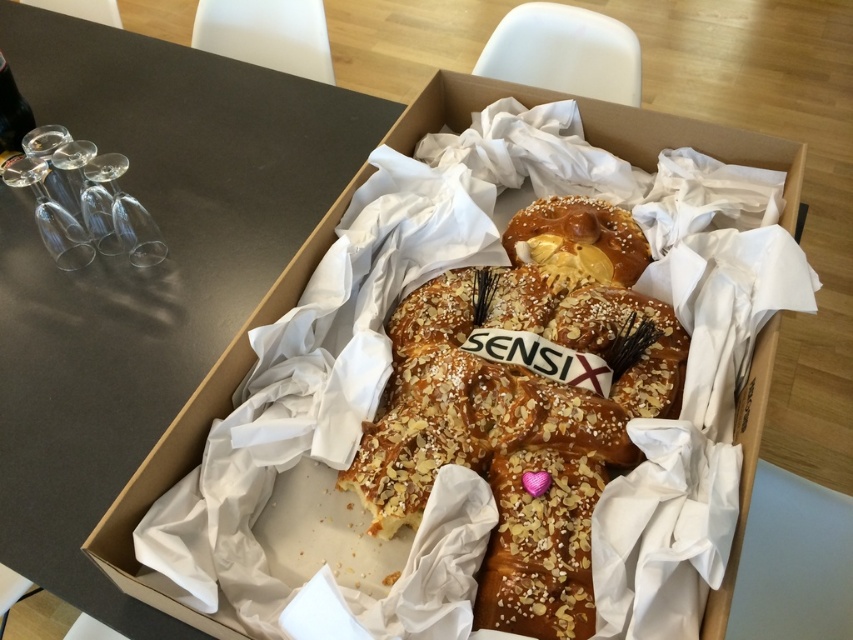
Question: Which object is the farthest from the golden glazed pastry at center?

Choices:
 (A) clear glass wine glass at left
 (B) smooth gray table at center
 (C) transparent glass wine glass at left

Answer: (A)

Question: Can you confirm if smooth gray table at center is bigger than transparent glass wine glass at left?

Choices:
 (A) yes
 (B) no

Answer: (A)

Question: Which of the following is the closest to the observer?

Choices:
 (A) transparent glass wine glass at left
 (B) smooth gray table at center
 (C) clear glass wine glass at left
 (D) golden glazed pastry at center

Answer: (B)

Question: Considering the real-world distances, which object is farthest from the smooth gray table at center?

Choices:
 (A) golden glazed pastry at center
 (B) clear glass wine glass at left

Answer: (A)

Question: Is clear glass wine glass at left positioned before transparent glass wine glass at left?

Choices:
 (A) yes
 (B) no

Answer: (B)

Question: Can you confirm if golden glazed pastry at center is positioned below clear glass wine glass at left?

Choices:
 (A) yes
 (B) no

Answer: (A)